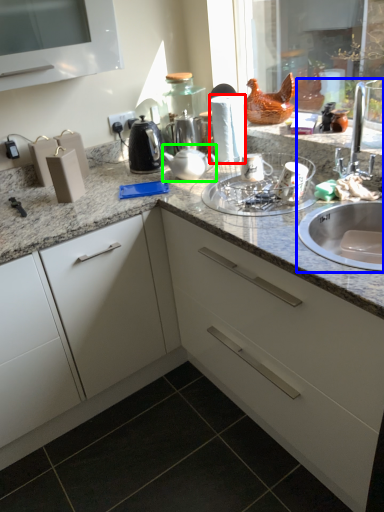
Question: Based on their relative distances, which object is farther from paper towel (highlighted by a red box)? Choose from sink (highlighted by a blue box) and tea pot (highlighted by a green box).

Choices:
 (A) sink
 (B) tea pot

Answer: (A)